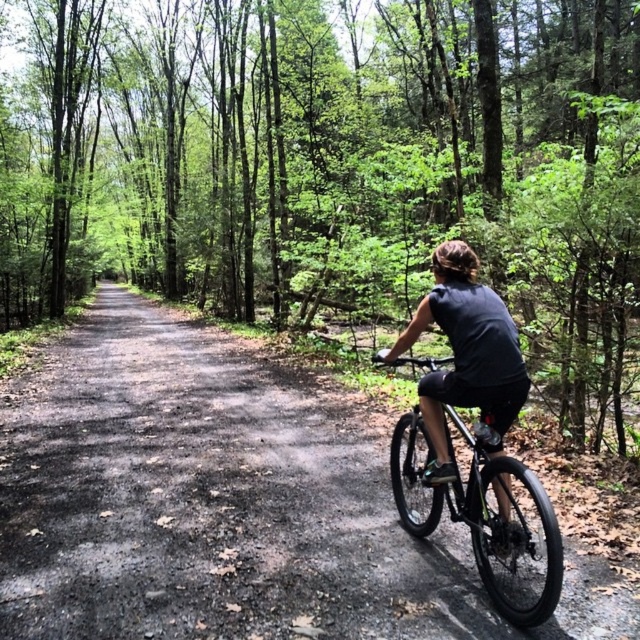
Who is higher up, green leafy forest at center or shiny black bike at right?

Positioned higher is green leafy forest at center.

Is green leafy forest at center to the left of shiny black bike at right from the viewer's perspective?

Indeed, green leafy forest at center is positioned on the left side of shiny black bike at right.

Is point (118, 196) positioned after point (445, 433)?

Yes, it is behind point (445, 433).

Find the location of a particular element. The width and height of the screenshot is (640, 640). green leafy forest at center is located at coordinates (336, 166).

Describe the element at coordinates (336, 166) in the screenshot. I see `green leafy forest at center` at that location.

Is point (108, 234) farther from camera compared to point (156, 513)?

Yes.

Where is `green leafy forest at center`? This screenshot has width=640, height=640. green leafy forest at center is located at coordinates (336, 166).

Who is positioned more to the left, green leafy forest at center or brown matte helmet at upper center?

Positioned to the left is green leafy forest at center.

Who is higher up, green leafy forest at center or brown matte helmet at upper center?

green leafy forest at center is above.

At what (x,y) coordinates should I click in order to perform the action: click on green leafy forest at center. Please return your answer as a coordinate pair (x, y). The width and height of the screenshot is (640, 640). Looking at the image, I should click on coord(336,166).